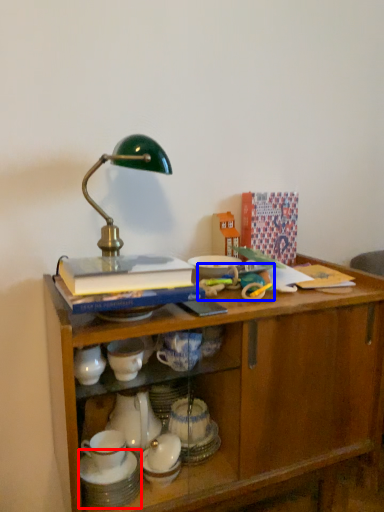
Question: Which object is further to the camera taking this photo, tableware (highlighted by a red box) or toy (highlighted by a blue box)?

Choices:
 (A) tableware
 (B) toy

Answer: (B)